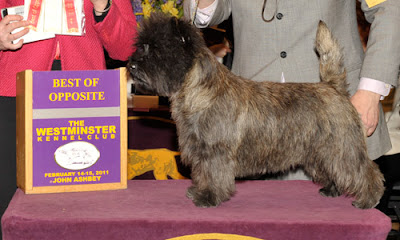
Locate an element on the screen. Image resolution: width=400 pixels, height=240 pixels. purple table cloth is located at coordinates (281, 205).